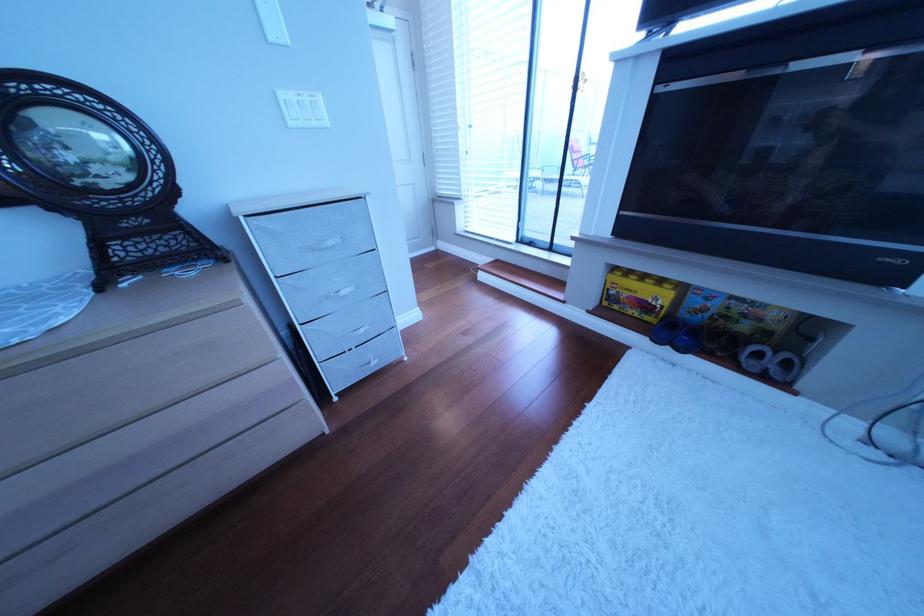
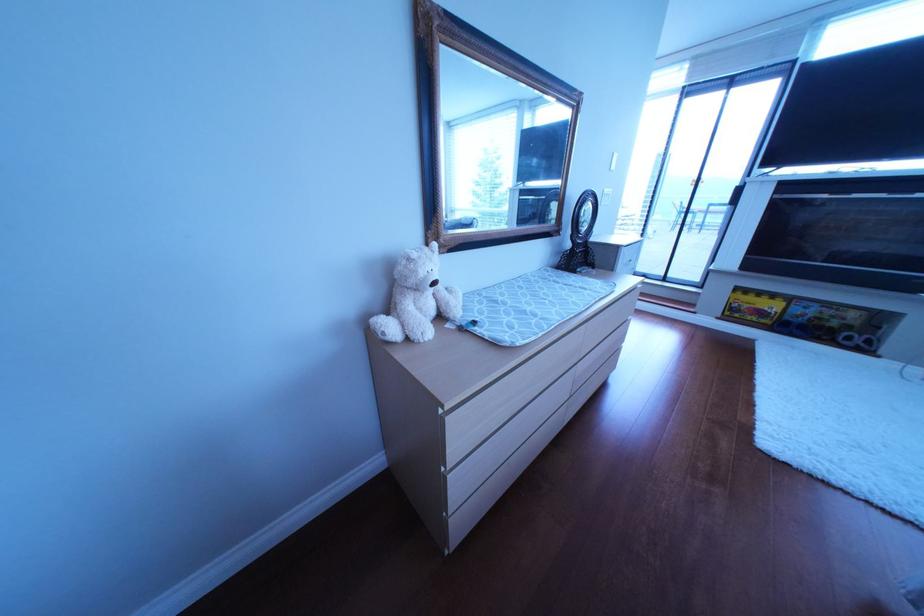
Where in the second image is the point corresponding to [602,314] from the first image?

(733, 320)